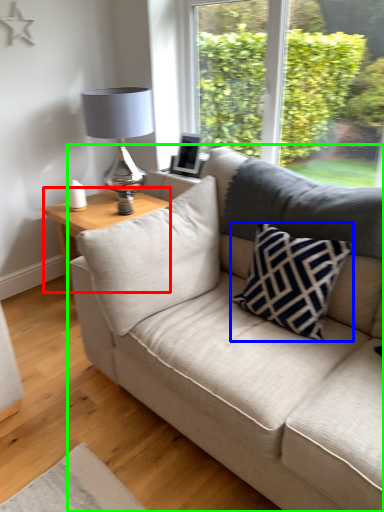
Question: Based on their relative distances, which object is farther from table (highlighted by a red box)? Choose from pillow (highlighted by a blue box) and studio couch (highlighted by a green box).

Choices:
 (A) pillow
 (B) studio couch

Answer: (A)